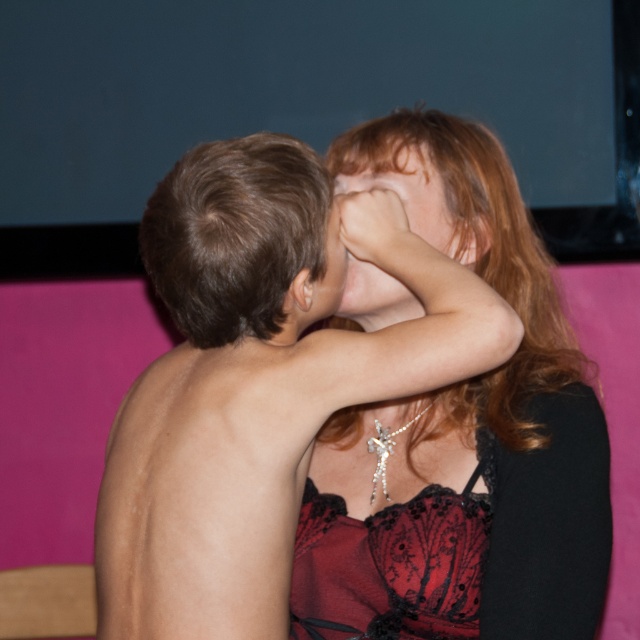
You are an interior designer trying to place a new sofa in the living room. The sofa must be placed exactly where the matte black lace dress at center is located. What are the coordinates where you should place the sofa?

The coordinates for placing the sofa should be at point [465,449], as that is where the matte black lace dress at center is located.

You are a fashion designer observing the scene. You notice the matte black lace dress at center and the velvet lace dress at center. Which dress is positioned higher in the image?

The matte black lace dress at center is positioned higher than the velvet lace dress at center.

You are a photographer setting up for a photoshoot. You need to ensure that the velvet lace dress at center is visible above the matte black face at center in the final image. Based on the scene description, will this be possible?

Yes, the velvet lace dress at center has a greater height compared to the matte black face at center, so it will be visible above it in the final image.